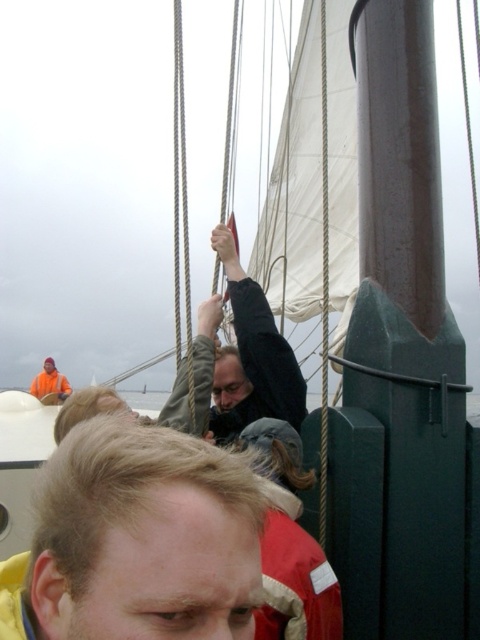
Question: Among these points, which one is farthest from the camera?

Choices:
 (A) (320, 512)
 (B) (36, 394)
 (C) (288, 576)
 (D) (213, 481)

Answer: (B)

Question: In this image, where is blonde hair at lower left located relative to orange fabric life jacket at left?

Choices:
 (A) left
 (B) right

Answer: (B)

Question: Can you confirm if white cord at center is wider than orange fabric life jacket at left?

Choices:
 (A) no
 (B) yes

Answer: (A)

Question: Which of these objects is positioned closest to the dark gray fabric at center?

Choices:
 (A) white cord at center
 (B) orange fabric life jacket at left

Answer: (A)

Question: In this image, where is red fleece life jacket at lower center located relative to orange fabric life jacket at left?

Choices:
 (A) above
 (B) below

Answer: (B)

Question: Which point is closer to the camera taking this photo?

Choices:
 (A) (188, 556)
 (B) (47, 369)

Answer: (A)